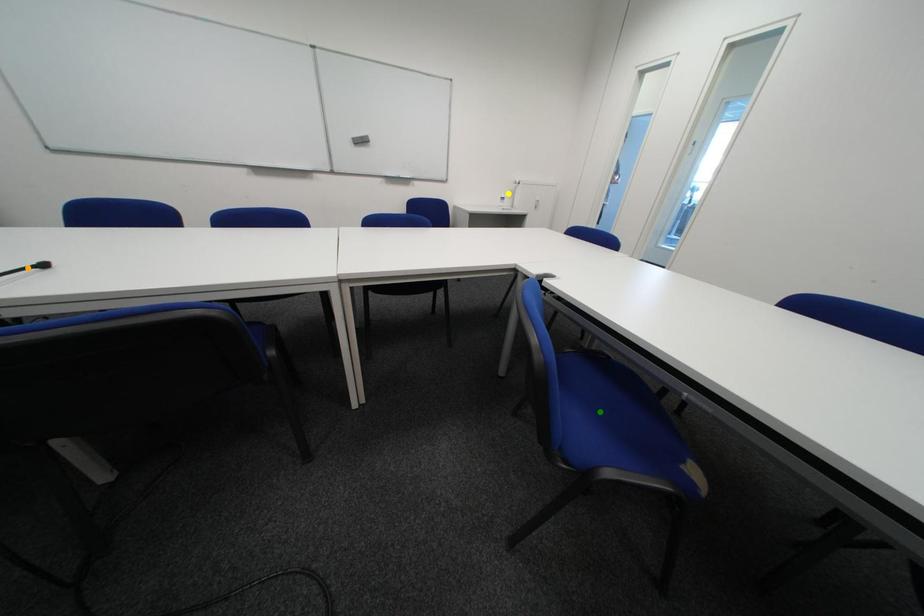
Looking at this image, order these from nearest to farthest:
green point | yellow point | orange point

yellow point
orange point
green point